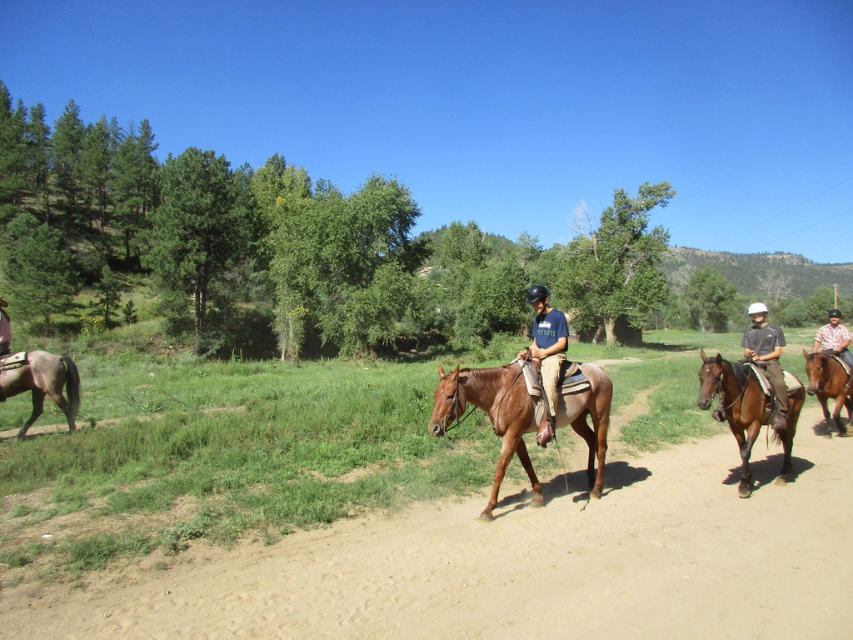
Is dark gray fabric shirt at center shorter than brown glossy horse at right?

No, dark gray fabric shirt at center is not shorter than brown glossy horse at right.

Is dark gray fabric shirt at center to the left of brown glossy horse at right from the viewer's perspective?

In fact, dark gray fabric shirt at center is to the right of brown glossy horse at right.

The height and width of the screenshot is (640, 853). I want to click on dark gray fabric shirt at center, so click(x=767, y=356).

Does point (572, 397) come behind point (825, 352)?

That is False.

Who is taller, brown glossy horse at center or plaid shirt at center?

plaid shirt at center

Identify the location of brown glossy horse at center. This screenshot has height=640, width=853. (490, 416).

This screenshot has height=640, width=853. Identify the location of brown glossy horse at center. point(490,416).

Does brown matte horse at left appear on the right side of brown leather saddle at center?

Yes, brown matte horse at left is to the right of brown leather saddle at center.

Does brown matte horse at left have a lesser height compared to brown leather saddle at center?

In fact, brown matte horse at left may be taller than brown leather saddle at center.

Image resolution: width=853 pixels, height=640 pixels. Describe the element at coordinates (39, 381) in the screenshot. I see `brown matte horse at left` at that location.

Image resolution: width=853 pixels, height=640 pixels. What are the coordinates of `brown matte horse at left` in the screenshot? It's located at (39, 381).